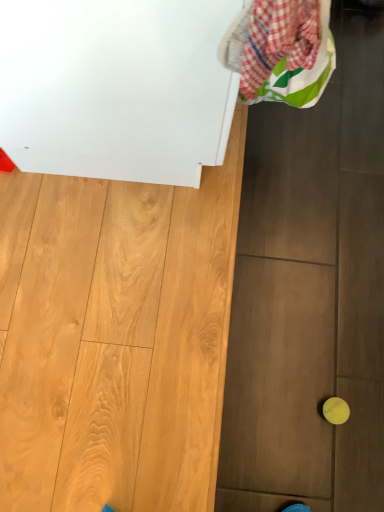
I want to click on free space to the right of yellow rubber ball at lower right, so click(373, 412).